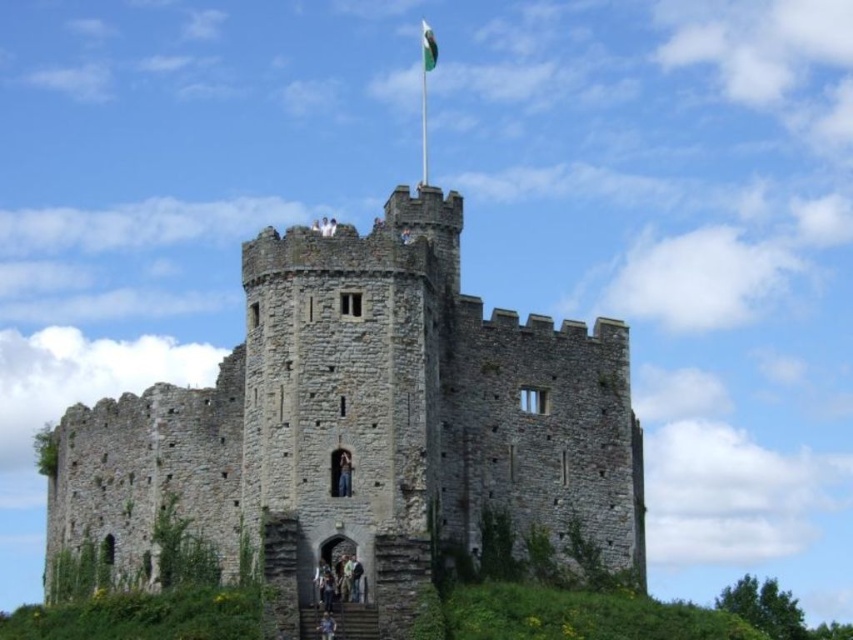
Question: In this image, where is gray stone castle at center located relative to green fabric flag at upper center?

Choices:
 (A) right
 (B) left

Answer: (B)

Question: Can you confirm if gray stone castle at center is thinner than green fabric flag at upper center?

Choices:
 (A) no
 (B) yes

Answer: (A)

Question: Is gray stone castle at center positioned at the back of green fabric flag at upper center?

Choices:
 (A) yes
 (B) no

Answer: (B)

Question: Which object appears farthest from the camera in this image?

Choices:
 (A) green fabric flag at upper center
 (B) gray stone castle at center

Answer: (A)